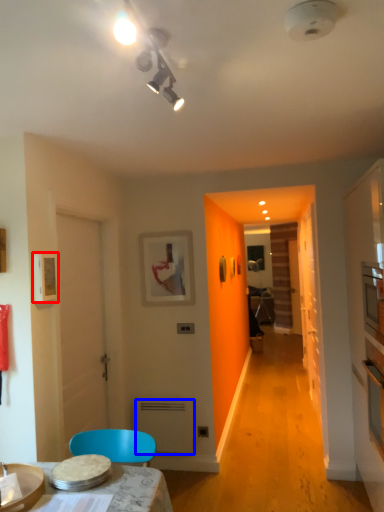
Question: Which object appears closest to the camera in this image, picture frame (highlighted by a red box) or appliance (highlighted by a blue box)?

Choices:
 (A) picture frame
 (B) appliance

Answer: (A)